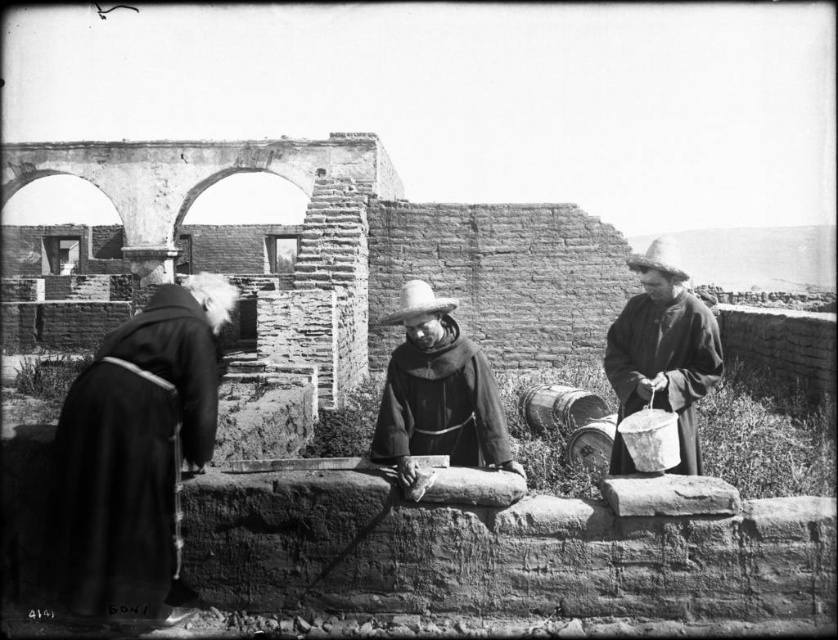
You are a historian trying to determine if two people in dark woolen robes are within shouting distance of each other in the historical photograph. The dark woolen robe at left and the dark brown woolen robe at right are present. Can you confirm if they can hear each other without raising their voices?

The dark woolen robe at left and the dark brown woolen robe at right are 54.09 feet apart. Since shouting distance is typically around 50 feet, they would need to raise their voices slightly to hear each other, but it is possible without shouting excessively.

Looking at this image, you are a tailor in this historical setting and need to determine which robe can accommodate a larger embroidery design. Based on the image, which robe between the smooth brown robe at center and the dark brown woolen robe at right is more suitable?

The dark brown woolen robe at right is larger than the smooth brown robe at center, making it more suitable for a larger embroidery design.

You are an observer standing in front of the stone wall. You see the dark woolen robe at left and the smooth brown robe at center. Which robe is wider?

The smooth brown robe at center is wider than the dark woolen robe at left.